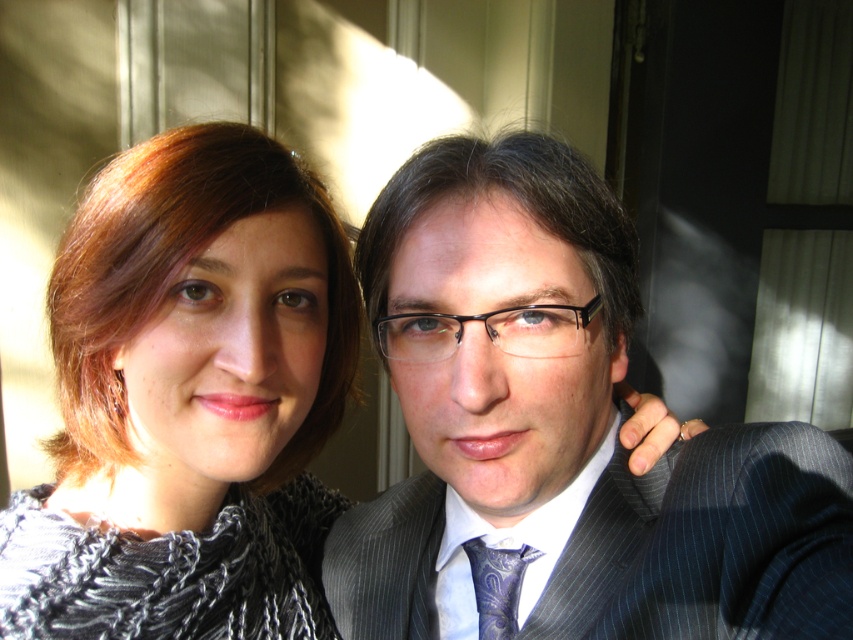
You are a photographer adjusting the lighting in the studio. You need to ensure that the knitted gray sweater at left is illuminated properly. Where should you place the light source relative to the sweater?

The knitted gray sweater at left is positioned at point (189, 401), so the light source should be placed in front of it to ensure proper illumination.